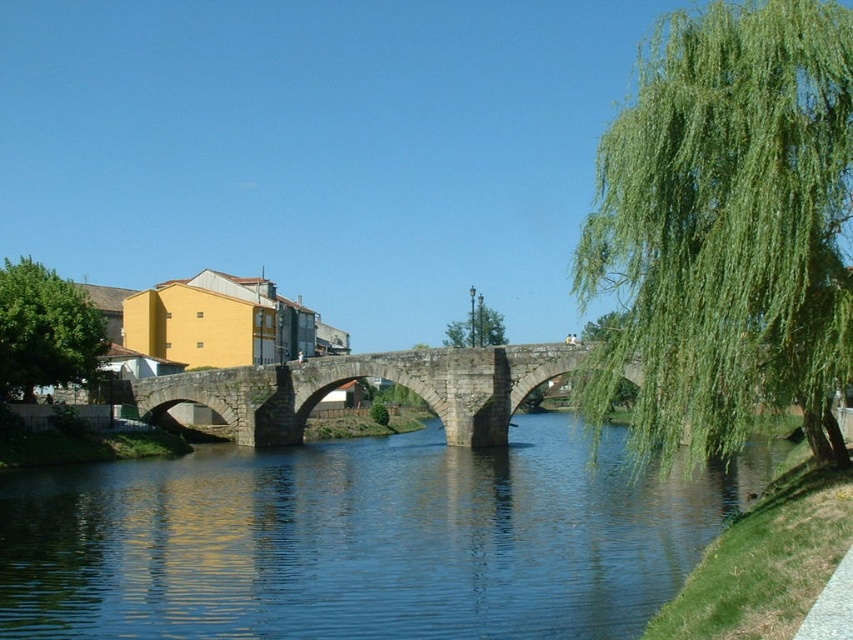
You are standing on the riverside path and see the blue stone bridge at center and the green leafy tree at upper right. Which object is positioned higher in the image?

The green leafy tree at upper right is positioned higher in the image than the blue stone bridge at center.

You are standing at the center of the stone bridge and want to locate the green leafy willow at right. In which direction should you look to see it?

The green leafy willow at right is located at point (728, 227), so you should look to your right side to see it.

You are an artist planning to paint the riverside scene. You want to ensure the green leafy willow at right and the green leafy tree at upper right are proportionally accurate. Which tree should you depict as taller in your painting?

The green leafy willow at right should be depicted as taller in the painting since it has a greater height compared to the green leafy tree at upper right according to the description.